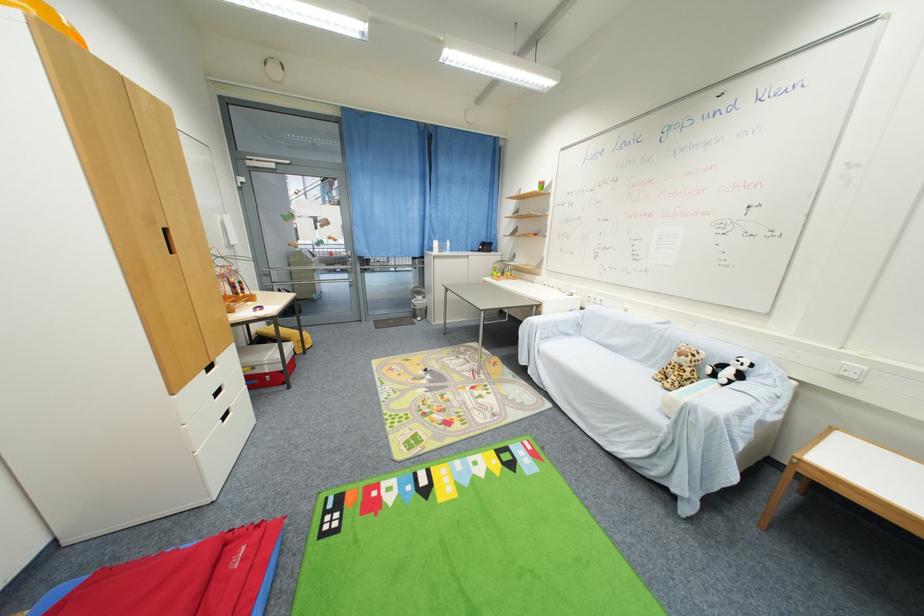
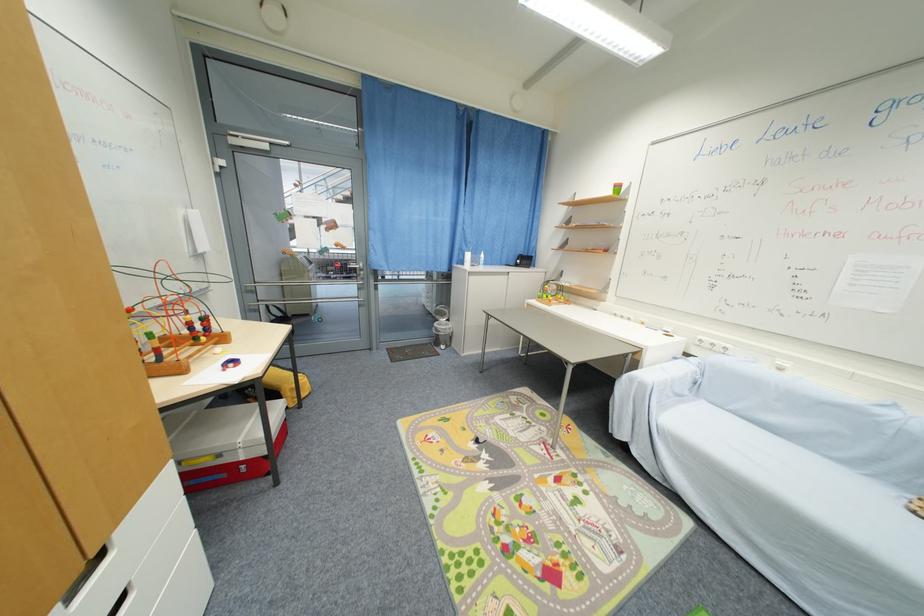
The point at [418,302] is marked in the first image. Where is the corresponding point in the second image?

(441, 326)